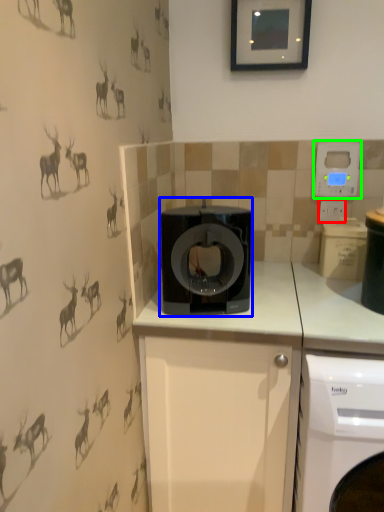
Question: Considering the real-world distances, which object is closest to electric outlet (highlighted by a red box)? home appliance (highlighted by a blue box) or thermostat (highlighted by a green box).

Choices:
 (A) home appliance
 (B) thermostat

Answer: (B)